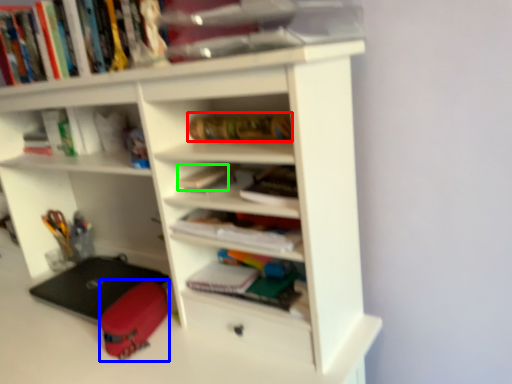
Question: Which object is positioned closest to book (highlighted by a red box)? Select from luggage (highlighted by a blue box) and book (highlighted by a green box).

Choices:
 (A) luggage
 (B) book

Answer: (B)